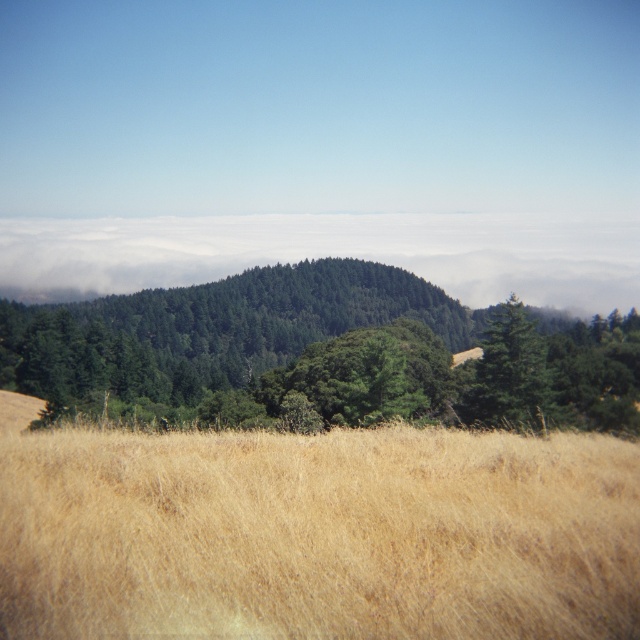
Question: Which is farther from the green matte tree at center-right?

Choices:
 (A) green matte tree at center
 (B) dry grass at lower center

Answer: (A)

Question: Can you confirm if green matte tree at center is wider than green matte tree at center-right?

Choices:
 (A) yes
 (B) no

Answer: (A)

Question: Is dry grass at lower center smaller than green matte tree at center-right?

Choices:
 (A) no
 (B) yes

Answer: (B)

Question: Can you confirm if dry grass at lower center is bigger than green matte tree at center?

Choices:
 (A) no
 (B) yes

Answer: (A)

Question: Among these points, which one is nearest to the camera?

Choices:
 (A) (486, 384)
 (B) (499, 406)
 (C) (488, 470)

Answer: (C)

Question: Which point is farther to the camera?

Choices:
 (A) (573, 620)
 (B) (497, 326)

Answer: (B)